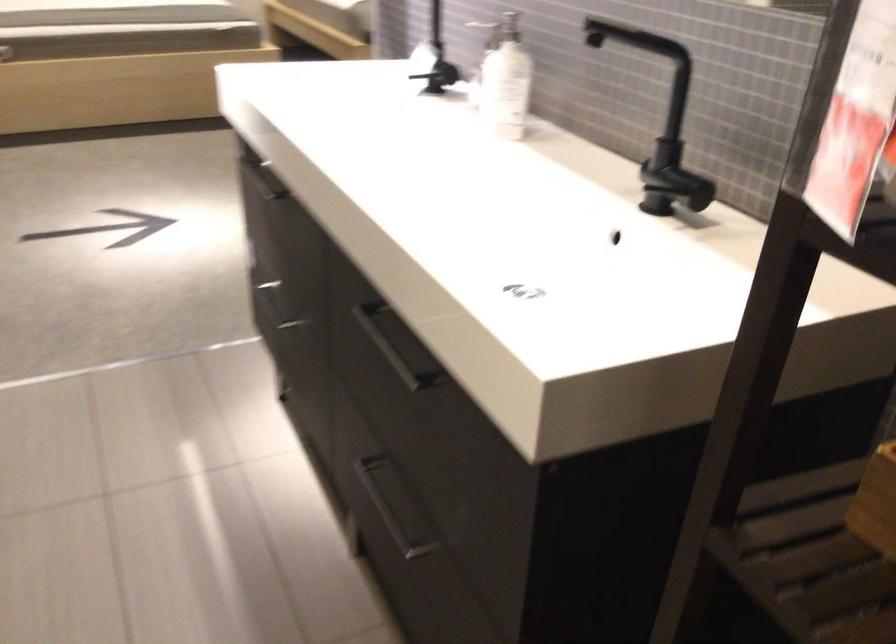
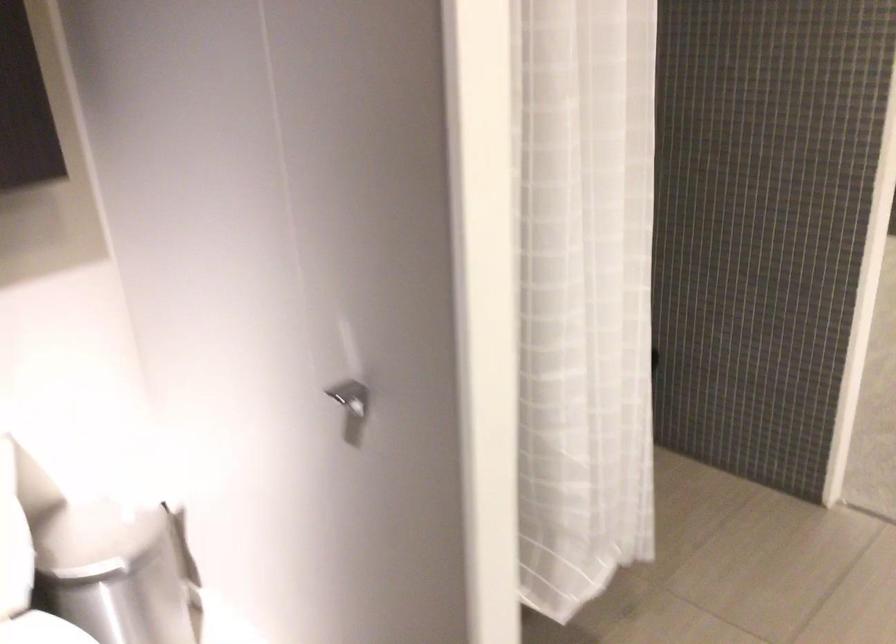
Question: Based on the continuous images, in which direction is the camera rotating? Reply with the corresponding letter.

Choices:
 (A) Left
 (B) Right
 (C) Up
 (D) Down

Answer: (A)